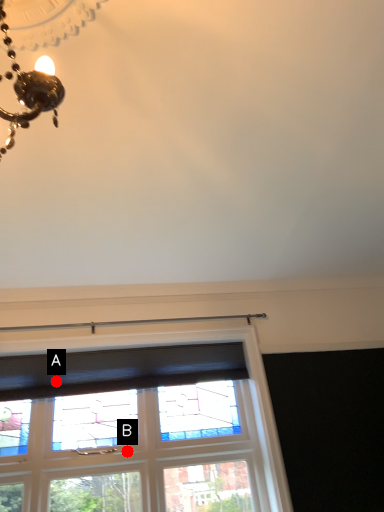
Question: Two points are circled on the image, labeled by A and B beside each circle. Among these points, which one is nearest to the camera?

Choices:
 (A) A is closer
 (B) B is closer

Answer: (B)